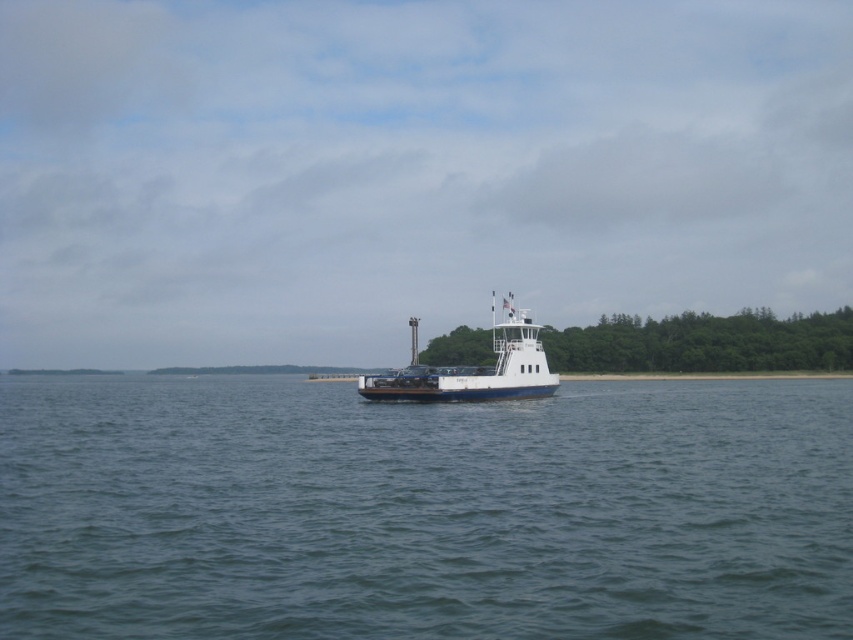
Can you confirm if blue water at center is positioned below white glossy ferry at center?

Yes, blue water at center is below white glossy ferry at center.

Between blue water at center and white glossy ferry at center, which one has less height?

blue water at center

What do you see at coordinates (422, 509) in the screenshot? I see `blue water at center` at bounding box center [422, 509].

Where is `blue water at center`? This screenshot has width=853, height=640. blue water at center is located at coordinates (422, 509).